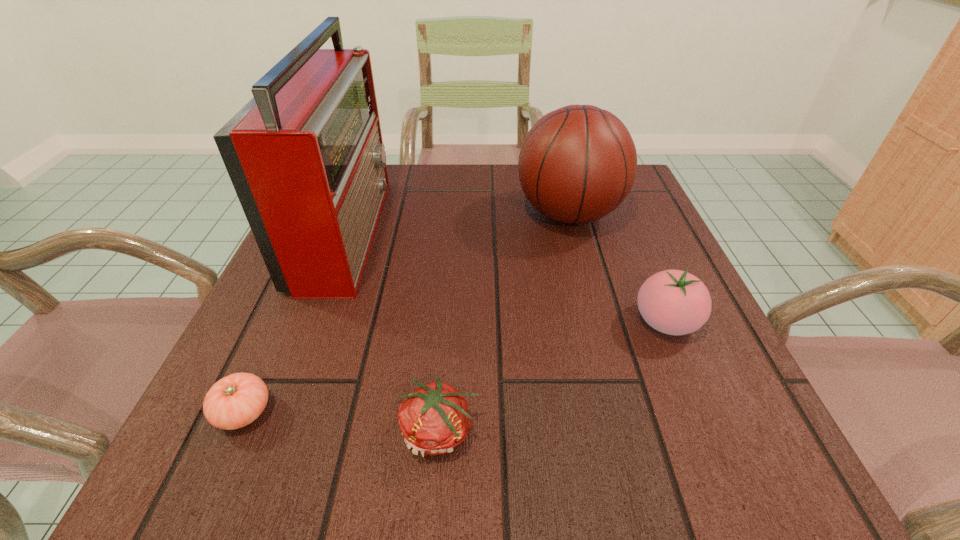
Identify the location of the tallest object. (305, 155).

Where is `basketball`? The image size is (960, 540). basketball is located at coordinates (577, 164).

This screenshot has width=960, height=540. I want to click on the rightmost tomato, so click(x=674, y=302).

This screenshot has width=960, height=540. I want to click on the farthest tomato, so click(674, 302).

Locate an element on the screen. Image resolution: width=960 pixels, height=540 pixels. the second tallest tomato is located at coordinates (434, 419).

I want to click on the third object from left to right, so click(x=434, y=419).

Locate an element on the screen. This screenshot has height=540, width=960. the shortest tomato is located at coordinates (234, 401).

The image size is (960, 540). I want to click on the shortest object, so click(x=234, y=401).

This screenshot has height=540, width=960. What are the coordinates of `vacant region located on the front-facing side of the tallest object` in the screenshot? It's located at (470, 230).

At what (x,y) coordinates should I click in order to perform the action: click on vacant area situated 0.340m on the front of the basketball. Please return your answer as a coordinate pair (x, y). The width and height of the screenshot is (960, 540). Looking at the image, I should click on (615, 389).